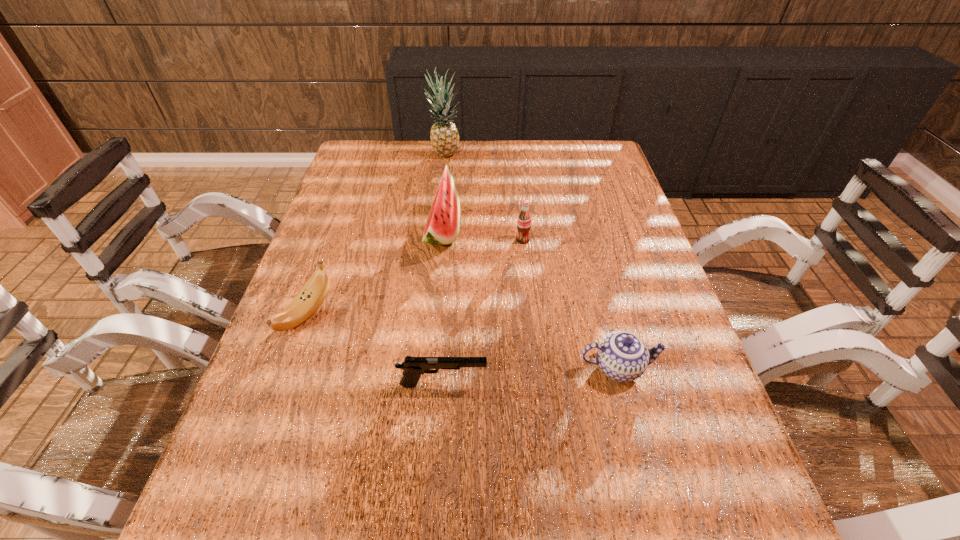
Locate an element on the screen. Image resolution: width=960 pixels, height=540 pixels. the farthest object is located at coordinates [x=444, y=135].

Identify the location of pineapple. This screenshot has width=960, height=540. (444, 135).

Where is `watermelon`? This screenshot has height=540, width=960. watermelon is located at coordinates (442, 227).

This screenshot has width=960, height=540. I want to click on soda, so click(x=524, y=219).

The image size is (960, 540). I want to click on banana, so click(x=312, y=295).

Find the location of a particular element. The height and width of the screenshot is (540, 960). the leftmost object is located at coordinates (312, 295).

This screenshot has width=960, height=540. I want to click on the rightmost object, so click(622, 356).

The image size is (960, 540). In order to click on gun in this screenshot , I will do `click(414, 367)`.

The image size is (960, 540). I want to click on free space located on the front of the pineapple, so click(437, 235).

You are a GUI agent. You are given a task and a screenshot of the screen. Output one action in this format:
    pyautogui.click(x=<x>, y=<y>)
    Task: Click on the free location located on the outer rind of the watermelon
    The width and height of the screenshot is (960, 540).
    Given the screenshot: What is the action you would take?
    pyautogui.click(x=569, y=234)